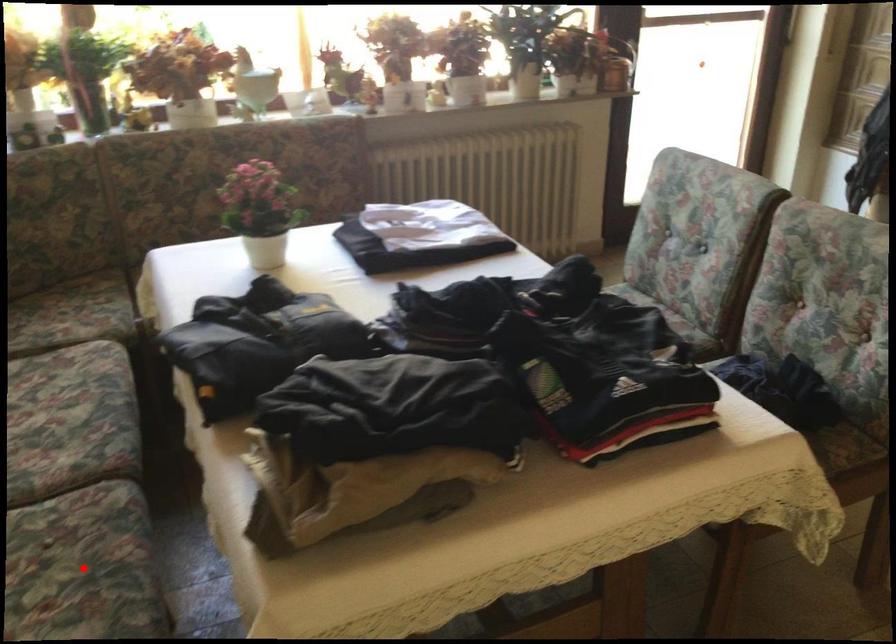
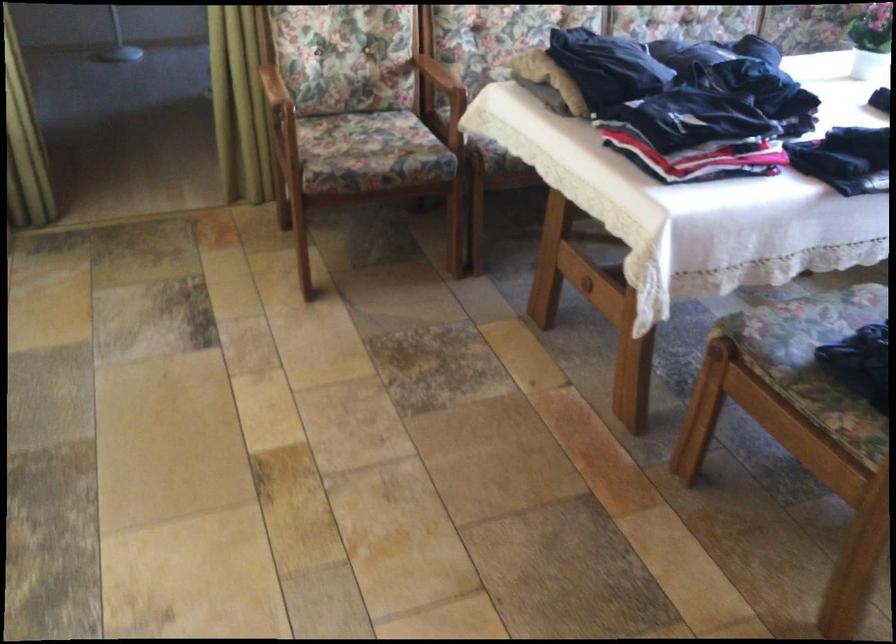
Question: I am providing you with two images of the same scene from different viewpoints. A red point is marked on the first image. At the location where the point appears in image 1, is it still visible in image 2?

Choices:
 (A) Yes
 (B) No

Answer: (B)